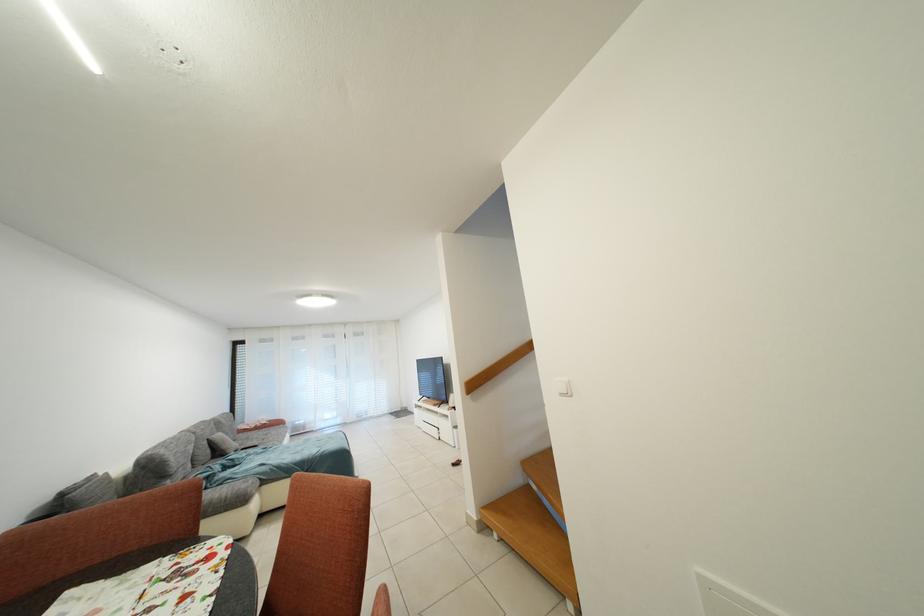
You are a GUI agent. You are given a task and a screenshot of the screen. Output one action in this format:
    pyautogui.click(x=<x>, y=<y>)
    Task: Click on the grey sofa cushion
    The width and height of the screenshot is (924, 616).
    Given the screenshot: What is the action you would take?
    pyautogui.click(x=98, y=490)